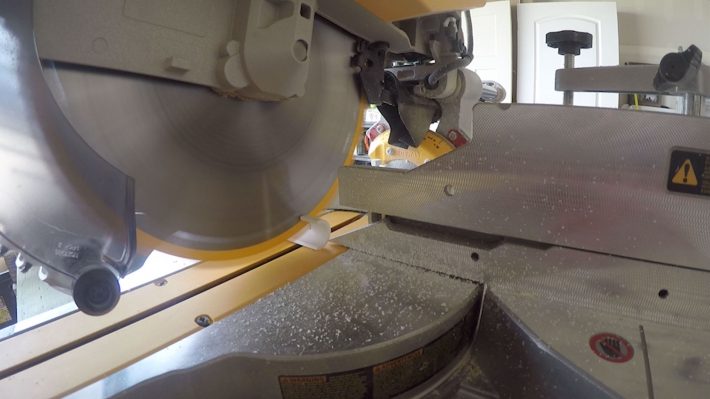
This screenshot has width=710, height=399. Find the location of `top of door`. top of door is located at coordinates (540, 33).